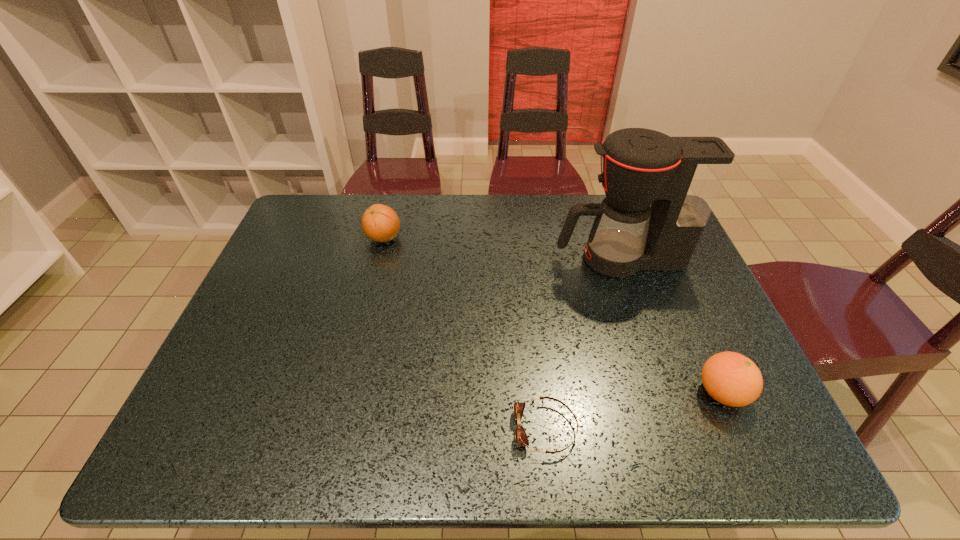
I want to click on vacant area that lies between the shortest object and the right orange, so click(634, 411).

You are a GUI agent. You are given a task and a screenshot of the screen. Output one action in this format:
    pyautogui.click(x=<x>, y=<y>)
    Task: Click on the vacant point located between the nearer orange and the farther orange
    
    Given the screenshot: What is the action you would take?
    pyautogui.click(x=553, y=315)

Where is `vacant area that lies between the left orange and the tallest object`? The width and height of the screenshot is (960, 540). vacant area that lies between the left orange and the tallest object is located at coordinates (501, 248).

This screenshot has height=540, width=960. Find the location of `vacant space that's between the second object from left to right and the nearer orange`. vacant space that's between the second object from left to right and the nearer orange is located at coordinates (634, 411).

Where is `free area in between the shortest object and the left orange`? Image resolution: width=960 pixels, height=540 pixels. free area in between the shortest object and the left orange is located at coordinates (465, 333).

Where is `free space between the tallest object and the goggles`? This screenshot has height=540, width=960. free space between the tallest object and the goggles is located at coordinates (583, 344).

The width and height of the screenshot is (960, 540). Find the location of `object that is the third closest one to the leftmost object`. object that is the third closest one to the leftmost object is located at coordinates (732, 379).

This screenshot has width=960, height=540. What are the coordinates of `object identified as the second closest to the right orange` in the screenshot? It's located at tap(681, 177).

This screenshot has width=960, height=540. I want to click on free point that satisfies the following two spatial constraints: 1. on the front side of the farther orange; 2. on the right side of the right orange, so click(345, 393).

Locate an element on the screen. This screenshot has width=960, height=540. free space that satisfies the following two spatial constraints: 1. on the front side of the nearer orange; 2. through the lenses of the goggles is located at coordinates [738, 429].